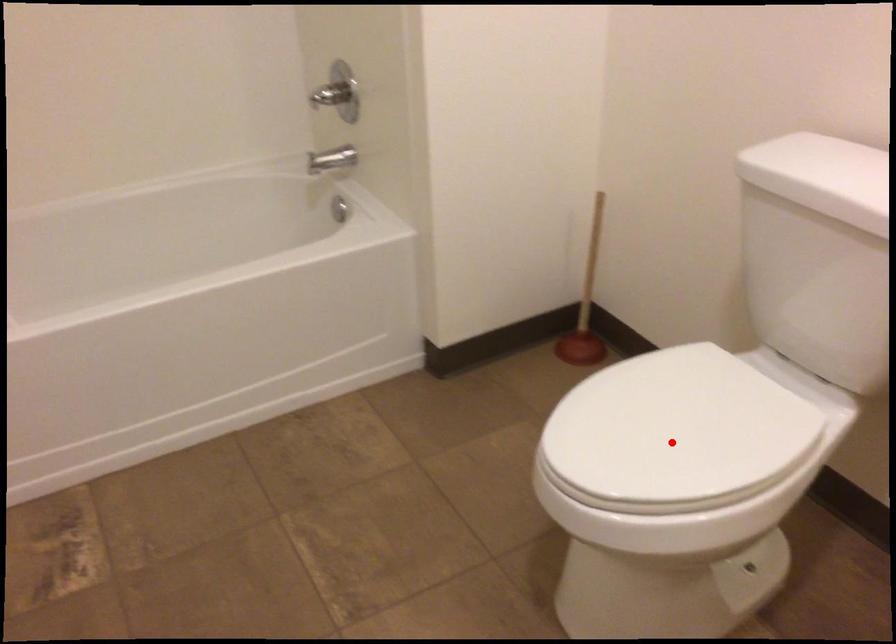
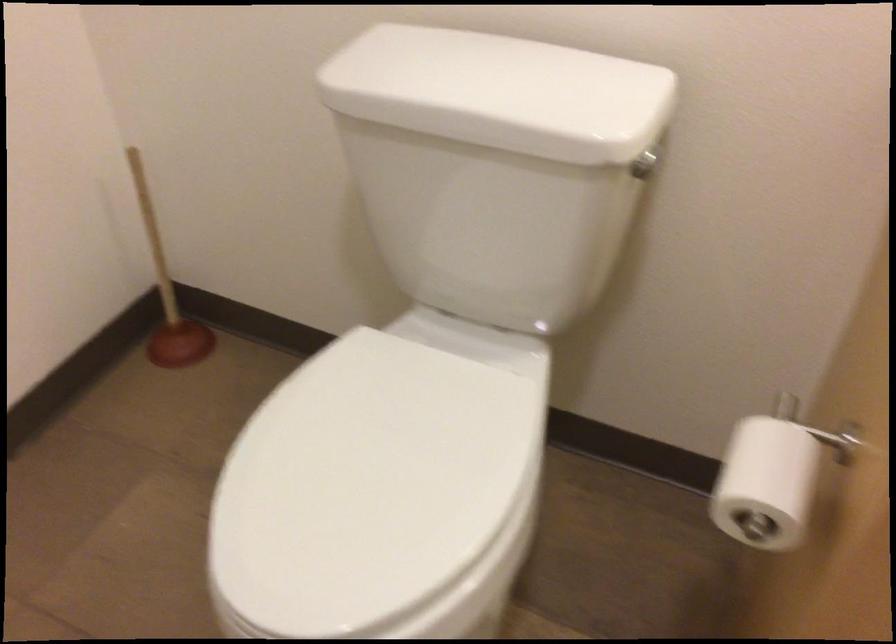
Question: A red point is marked in image1. In image2, is the corresponding 3D point closer to the camera or farther? Reply with the corresponding letter.

Choices:
 (A) The corresponding 3D point is closer.
 (B) The corresponding 3D point is farther.

Answer: (A)